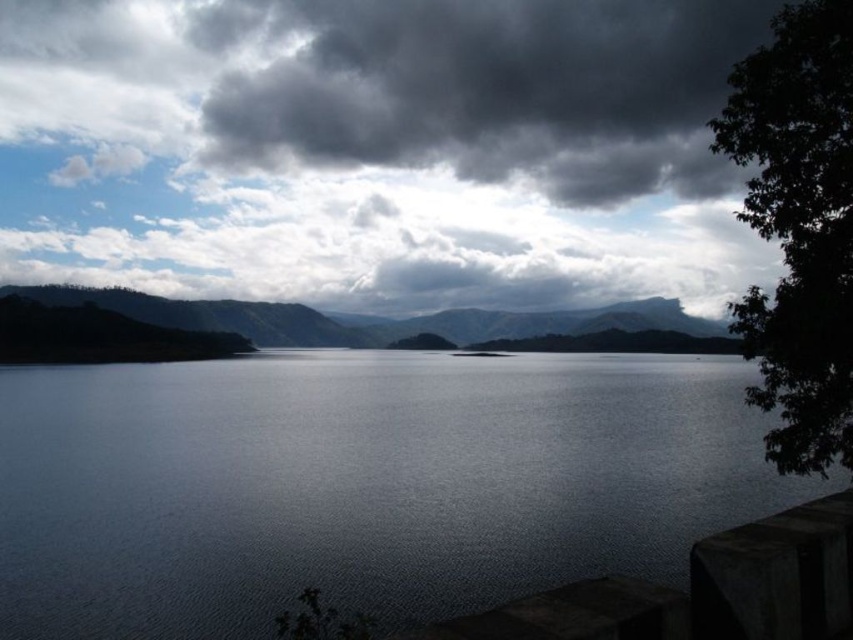
Question: Does dark gray water at center have a lesser width compared to green matte mountain at center?

Choices:
 (A) yes
 (B) no

Answer: (A)

Question: Can you confirm if dark gray water at center is positioned below dark gray cloud at upper center?

Choices:
 (A) yes
 (B) no

Answer: (A)

Question: Which of these objects is positioned closest to the green matte mountain at center?

Choices:
 (A) dark gray water at center
 (B) dark green leafy tree at right
 (C) dark gray cloud at upper center

Answer: (C)

Question: Does dark gray water at center appear on the right side of green matte mountain at center?

Choices:
 (A) yes
 (B) no

Answer: (A)

Question: Which of the following is the closest to the observer?

Choices:
 (A) dark gray water at center
 (B) dark green leafy tree at right
 (C) green matte mountain at center
 (D) dark gray cloud at upper center

Answer: (B)

Question: Estimate the real-world distances between objects in this image. Which object is closer to the green matte mountain at center?

Choices:
 (A) dark gray cloud at upper center
 (B) dark green leafy tree at right
 (C) dark gray water at center

Answer: (A)